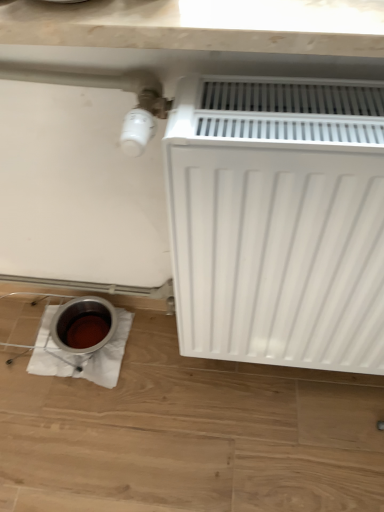
What do you see at coordinates (278, 220) in the screenshot?
I see `white matte radiator at right` at bounding box center [278, 220].

Measure the distance between white matte radiator at right and camera.

white matte radiator at right and camera are 51.04 centimeters apart.

The width and height of the screenshot is (384, 512). Identify the location of white matte radiator at right. click(x=278, y=220).

The height and width of the screenshot is (512, 384). I want to click on white matte radiator at right, so click(278, 220).